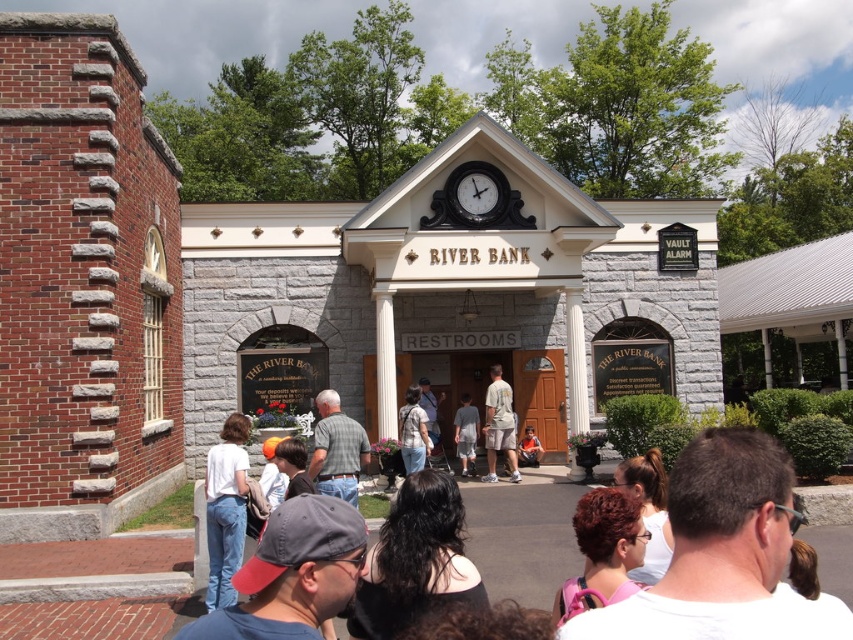
You are a visitor at the River Bank building and notice two items at the center of the image. Which item is closer to you, the plaid shirt at center or the light brown fabric shorts at center?

The plaid shirt at center is positioned over light brown fabric shorts at center, so the plaid shirt at center is closer to you.

From the picture: You are trying to decide which item to pack for a quick trip. Both the denim shirt at center and the gray cotton shorts at center are on your list. If you have limited space in your bag, which item should you leave behind to save more space?

The denim shirt at center is larger in size than the gray cotton shorts at center, so you should leave the denim shirt at center behind to save more space.

You are standing at the entrance of the River Bank building and see a white cotton shirt at center and a denim shirt at center. If you want to pick up both shirts, which one do you need to walk towards first?

The white cotton shirt at center and denim shirt at center are 10.91 meters apart from each other. Since you are at the entrance, you need to walk towards whichever shirt is closer to you. However, the description does not specify which shirt is closer, so you cannot determine the order without additional information.